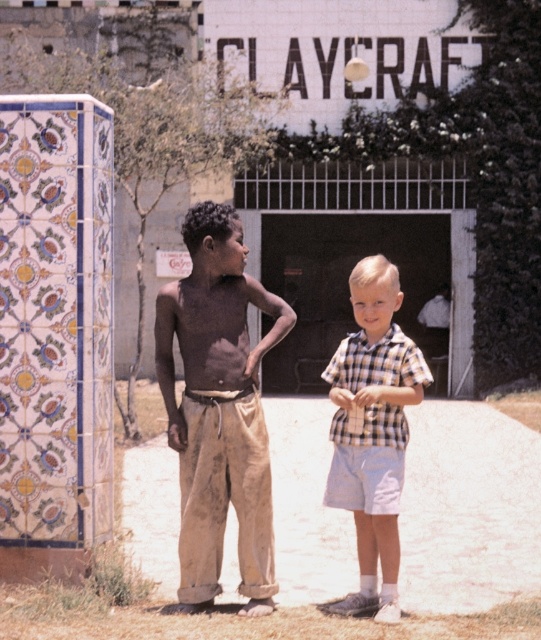
You are a tailor who needs to determine if the brown cotton pants at center can fit into a storage box designed for the checkered fabric shirt at center. Based on their widths, will the pants fit?

The brown cotton pants at center is wider than the checkered fabric shirt at center, so the pants will not fit into the storage box designed for the shirt.

You are a photographer trying to capture a candid shot of the two boys in front of the CLAYCRAFT sign. You want to ensure that both the brown cotton pants at center and the checkered fabric shirt at center are visible in the frame. Based on their positions, which boy should you focus on first to include both in the shot?

The brown cotton pants at center is to the left of the checkered fabric shirt at center, so focusing on the boy with the brown cotton pants at center first will allow you to include both in the frame since he is positioned to the left of the other boy.

You are a photographer trying to capture a photo of the two boys in the scene. You want to ensure that both the brown cotton pants at center and the checkered fabric shirt at center are clearly visible in the frame. Based on their sizes, which object should you focus on to ensure both are in focus?

The brown cotton pants at center is much taller than the checkered fabric shirt at center, so focusing on the brown cotton pants at center would ensure the checkered fabric shirt at center is also in focus due to its smaller size.